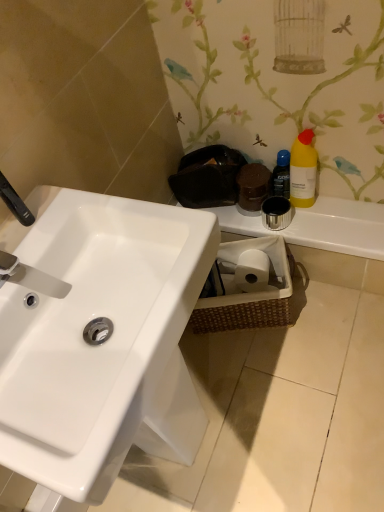
The image size is (384, 512). Describe the element at coordinates (281, 175) in the screenshot. I see `blue glossy bottle at upper right` at that location.

Locate an element on the screen. The width and height of the screenshot is (384, 512). yellow matte bottle at upper right is located at coordinates (303, 170).

In order to face white glossy sink at center, should I rotate leftwards or rightwards?

You should look left and rotate roughly 8.268 degrees.

The height and width of the screenshot is (512, 384). What do you see at coordinates (102, 343) in the screenshot? I see `white glossy sink at center` at bounding box center [102, 343].

The height and width of the screenshot is (512, 384). What do you see at coordinates (247, 287) in the screenshot? I see `woven brown basket at lower right` at bounding box center [247, 287].

How much space does matte silver faucet at left, placed as the 2th plumbing fixture when sorted from top to bottom, occupy vertically?

It is 4.77 inches.

This screenshot has height=512, width=384. Describe the element at coordinates (15, 202) in the screenshot. I see `brushed metal tap at upper left, the first plumbing fixture in the top-to-bottom sequence` at that location.

Describe the element at coordinates (320, 226) in the screenshot. Image resolution: width=384 pixels, height=512 pixels. I see `metallic silver cup at upper right` at that location.

Identify the location of blue glossy bottle at upper right. Image resolution: width=384 pixels, height=512 pixels. (281, 175).

Consider the image. Which is closer to the camera, (277, 177) or (325, 197)?

Point (277, 177) appears to be closer to the viewer than point (325, 197).

Measure the distance from blue glossy bottle at upper right to metallic silver cup at upper right.

18.96 centimeters.

Which of these two, blue glossy bottle at upper right or metallic silver cup at upper right, is wider?

With larger width is metallic silver cup at upper right.

Considering the relative sizes of blue glossy bottle at upper right and metallic silver cup at upper right in the image provided, is blue glossy bottle at upper right taller than metallic silver cup at upper right?

Indeed, blue glossy bottle at upper right has a greater height compared to metallic silver cup at upper right.

Which object is thinner, matte silver faucet at left, the 1th plumbing fixture when ordered from bottom to top, or blue glossy bottle at upper right?

blue glossy bottle at upper right is thinner.

Measure the distance from matte silver faucet at left, placed as the 2th plumbing fixture when sorted from top to bottom, to blue glossy bottle at upper right.

matte silver faucet at left, placed as the 2th plumbing fixture when sorted from top to bottom, and blue glossy bottle at upper right are 33.96 inches apart.

Which object is closer to the camera taking this photo, matte silver faucet at left, placed as the 2th plumbing fixture when sorted from top to bottom, or blue glossy bottle at upper right?

matte silver faucet at left, placed as the 2th plumbing fixture when sorted from top to bottom, is more forward.

Is woven brown basket at lower right facing away from white glossy sink at center?

No, woven brown basket at lower right is not facing away from white glossy sink at center.

Is point (226, 284) farther from camera compared to point (73, 369)?

Yes, point (226, 284) is farther from viewer.

This screenshot has width=384, height=512. In order to click on sink that appears on the left of woven brown basket at lower right in this screenshot , I will do `click(102, 343)`.

Is woven brown basket at lower right outside of white glossy sink at center?

Yes, woven brown basket at lower right is not within white glossy sink at center.

Which is more to the right, brushed metal tap at upper left, the first plumbing fixture in the top-to-bottom sequence, or blue glossy bottle at upper right?

From the viewer's perspective, blue glossy bottle at upper right appears more on the right side.

Is brushed metal tap at upper left, the first plumbing fixture in the top-to-bottom sequence, in front of blue glossy bottle at upper right?

Yes, brushed metal tap at upper left, the first plumbing fixture in the top-to-bottom sequence, is in front of blue glossy bottle at upper right.

From a real-world perspective, is brushed metal tap at upper left, which ranks as the 2th plumbing fixture in bottom-to-top order, positioned above or below blue glossy bottle at upper right?

brushed metal tap at upper left, which ranks as the 2th plumbing fixture in bottom-to-top order, is situated higher than blue glossy bottle at upper right in the real world.

Which of these two, brushed metal tap at upper left, the first plumbing fixture in the top-to-bottom sequence, or blue glossy bottle at upper right, is bigger?

blue glossy bottle at upper right.

Does point (223, 300) come in front of point (301, 147)?

No, it is behind (301, 147).

From the image's perspective, who appears lower, woven brown basket at lower right or yellow matte bottle at upper right?

woven brown basket at lower right is shown below in the image.

Locate an element on the screen. The image size is (384, 512). basket that appears on the left of yellow matte bottle at upper right is located at coordinates [247, 287].

From a real-world perspective, who is located higher, woven brown basket at lower right or yellow matte bottle at upper right?

yellow matte bottle at upper right is physically above.

Does yellow matte bottle at upper right come in front of woven brown basket at lower right?

That is True.

How far apart are yellow matte bottle at upper right and woven brown basket at lower right?

12.52 inches.

Is yellow matte bottle at upper right with woven brown basket at lower right?

They are not placed beside each other.

Image resolution: width=384 pixels, height=512 pixels. Find the location of `basket lying behind the yellow matte bottle at upper right`. basket lying behind the yellow matte bottle at upper right is located at coordinates (247, 287).

Is point (4, 195) positioned behind point (316, 227)?

No, (4, 195) is closer to viewer.

From the image's perspective, is brushed metal tap at upper left, which ranks as the 2th plumbing fixture in bottom-to-top order, located beneath metallic silver cup at upper right?

No.

Is brushed metal tap at upper left, the first plumbing fixture in the top-to-bottom sequence, in contact with metallic silver cup at upper right?

No, brushed metal tap at upper left, the first plumbing fixture in the top-to-bottom sequence, is not touching metallic silver cup at upper right.

This screenshot has width=384, height=512. What are the coordinates of `toiletry above the metallic silver cup at upper right (from a real-world perspective)` in the screenshot? It's located at (281, 175).

Find the location of a particular element. toiletry behind the matte silver faucet at left, placed as the 2th plumbing fixture when sorted from top to bottom is located at coordinates (281, 175).

From the image, which object appears to be farther from white glossy sink at center, brushed metal tap at upper left, which ranks as the 2th plumbing fixture in bottom-to-top order, or woven brown basket at lower right?

Among the two, woven brown basket at lower right is located further to white glossy sink at center.

Which object lies nearer to the anchor point brushed metal tap at upper left, the first plumbing fixture in the top-to-bottom sequence, metallic silver cup at upper right or matte silver faucet at left, the 1th plumbing fixture when ordered from bottom to top?

Based on the image, matte silver faucet at left, the 1th plumbing fixture when ordered from bottom to top, appears to be nearer to brushed metal tap at upper left, the first plumbing fixture in the top-to-bottom sequence.

When comparing their distances from white glossy sink at center, does brushed metal tap at upper left, which ranks as the 2th plumbing fixture in bottom-to-top order, or metallic silver cup at upper right seem further?

metallic silver cup at upper right is positioned further to the anchor white glossy sink at center.

When comparing their distances from matte silver faucet at left, the 1th plumbing fixture when ordered from bottom to top, does blue glossy bottle at upper right or yellow matte bottle at upper right seem closer?

Based on the image, blue glossy bottle at upper right appears to be nearer to matte silver faucet at left, the 1th plumbing fixture when ordered from bottom to top.

Based on their spatial positions, is woven brown basket at lower right or yellow matte bottle at upper right closer to matte silver faucet at left, the 1th plumbing fixture when ordered from bottom to top?

woven brown basket at lower right.

Based on their spatial positions, is metallic silver cup at upper right or woven brown basket at lower right further from brushed metal tap at upper left, the first plumbing fixture in the top-to-bottom sequence?

metallic silver cup at upper right is positioned further to the anchor brushed metal tap at upper left, the first plumbing fixture in the top-to-bottom sequence.

Considering their positions, is yellow matte bottle at upper right positioned closer to brushed metal tap at upper left, the first plumbing fixture in the top-to-bottom sequence, than blue glossy bottle at upper right?

Based on the image, blue glossy bottle at upper right appears to be nearer to brushed metal tap at upper left, the first plumbing fixture in the top-to-bottom sequence.

Consider the image. When comparing their distances from matte silver faucet at left, the 1th plumbing fixture when ordered from bottom to top, does white glossy sink at center or metallic silver cup at upper right seem closer?

white glossy sink at center is positioned closer to the anchor matte silver faucet at left, the 1th plumbing fixture when ordered from bottom to top.

Locate an element on the screen. This screenshot has width=384, height=512. basket located between brushed metal tap at upper left, which ranks as the 2th plumbing fixture in bottom-to-top order, and yellow matte bottle at upper right in the left-right direction is located at coordinates (247, 287).

This screenshot has height=512, width=384. In order to click on basket between matte silver faucet at left, the 1th plumbing fixture when ordered from bottom to top, and metallic silver cup at upper right, along the z-axis in this screenshot , I will do `click(247, 287)`.

I want to click on basket between matte silver faucet at left, placed as the 2th plumbing fixture when sorted from top to bottom, and yellow matte bottle at upper right, so (x=247, y=287).

Where is `cleaning product located between white glossy sink at center and blue glossy bottle at upper right in the depth direction`? The width and height of the screenshot is (384, 512). cleaning product located between white glossy sink at center and blue glossy bottle at upper right in the depth direction is located at coordinates (303, 170).